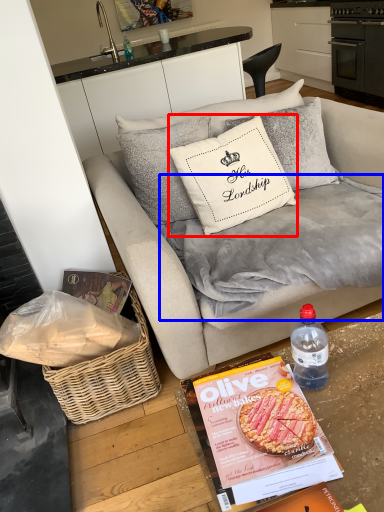
Question: Which object appears farthest to the camera in this image, pillow (highlighted by a red box) or blanket (highlighted by a blue box)?

Choices:
 (A) pillow
 (B) blanket

Answer: (A)